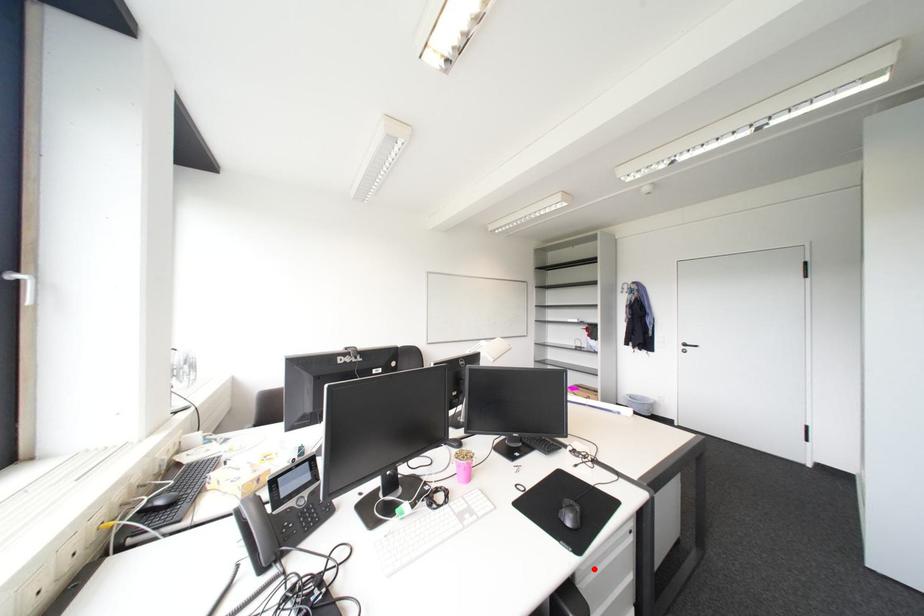
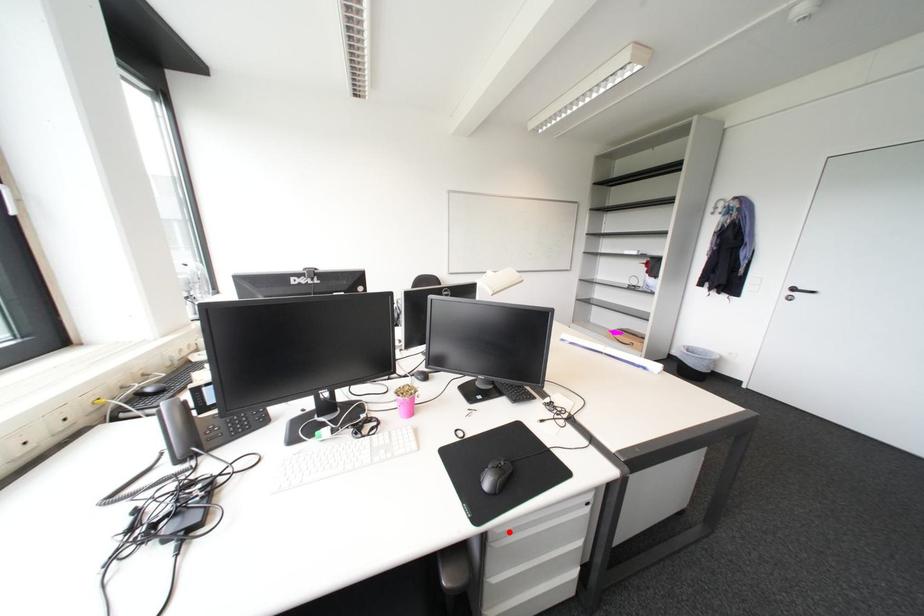
I am providing you with two images of the same scene from different viewpoints. A red point is marked on the first image and another point is marked on the second image. Is the marked point in image1 the same physical position as the marked point in image2?

Yes